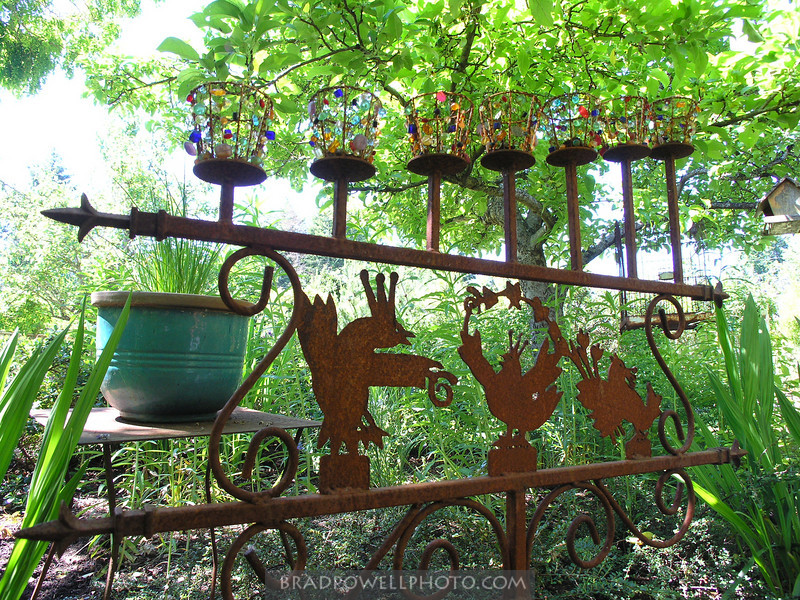
At what (x,y) coordinates should I click in order to perform the action: click on bird art. Please return your answer as a coordinate pair (x, y). Looking at the image, I should click on (356, 356), (518, 394), (617, 410).